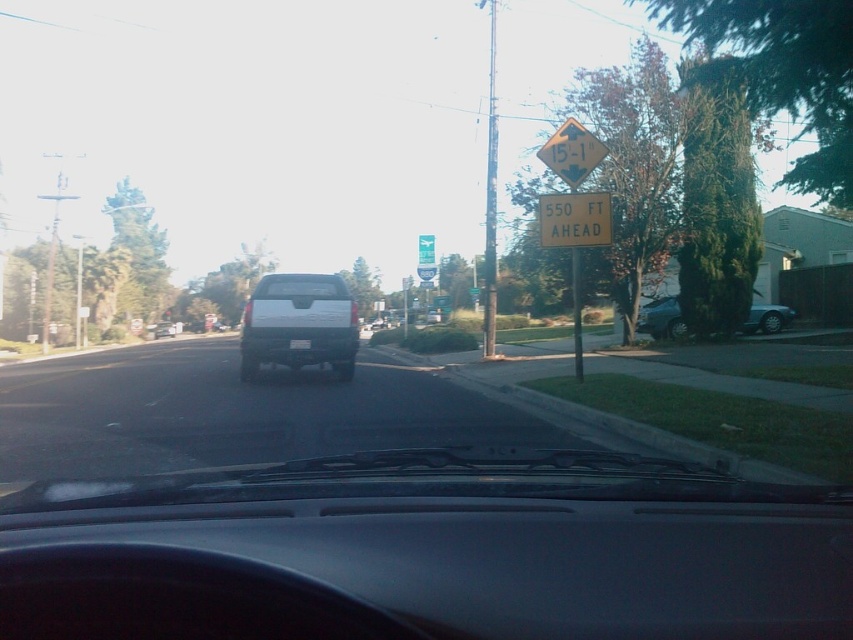
Between point (573, 125) and point (424, 275), which one is positioned behind?

The point (424, 275) is behind.

How far apart are yellow reflective diamond-shaped sign at upper right and yellow plastic sign at upper center?

They are 12.27 meters apart.

Is point (553, 140) less distant than point (421, 275)?

Yes.

Identify the location of yellow reflective diamond-shaped sign at upper right. Image resolution: width=853 pixels, height=640 pixels. (572, 152).

Does yellow reflective plastic sign at upper right have a greater height compared to metallic pole at center?

Incorrect, yellow reflective plastic sign at upper right's height is not larger of metallic pole at center's.

Who is higher up, yellow reflective plastic sign at upper right or metallic pole at center?

Positioned higher is metallic pole at center.

Does point (601, 198) come in front of point (495, 228)?

Yes.

This screenshot has height=640, width=853. I want to click on yellow reflective plastic sign at upper right, so click(573, 220).

Is green plastic sign at center positioned behind yellow plastic sign at upper center?

No.

What do you see at coordinates (426, 250) in the screenshot?
I see `green plastic sign at center` at bounding box center [426, 250].

Locate an element on the screen. The image size is (853, 640). green plastic sign at center is located at coordinates (426, 250).